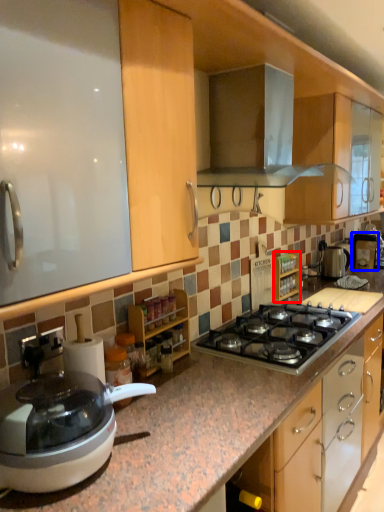
Question: Which object appears closest to the camera in this image, cabinetry (highlighted by a red box) or coffee machine (highlighted by a blue box)?

Choices:
 (A) cabinetry
 (B) coffee machine

Answer: (A)